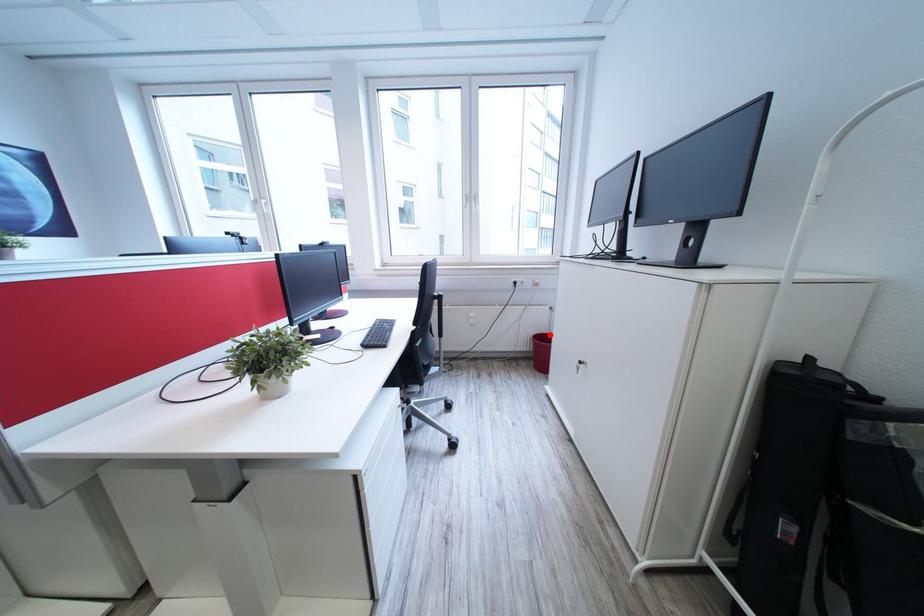
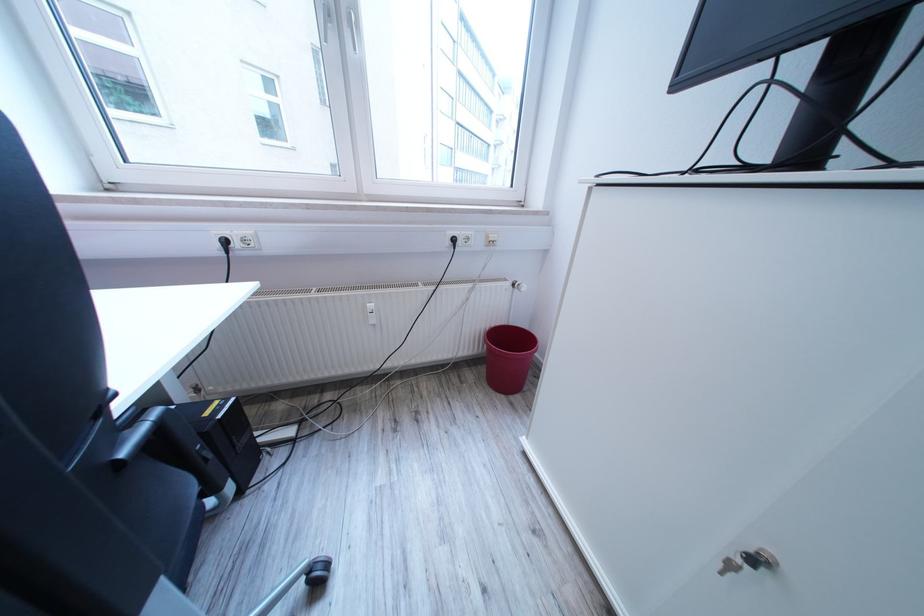
Find the pixel in the second image that matches the highlighted location in the first image.

(504, 326)